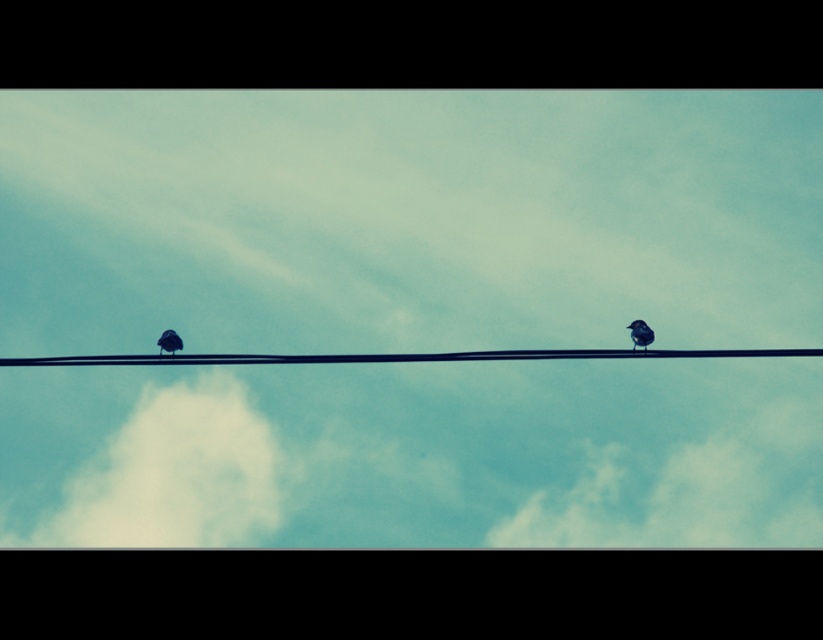
Is point (814, 516) closer to camera compared to point (180, 344)?

No, it is not.

Is point (751, 486) positioned behind point (171, 344)?

Yes, point (751, 486) is behind point (171, 344).

Image resolution: width=823 pixels, height=640 pixels. Describe the element at coordinates (689, 492) in the screenshot. I see `white fluffy cloud at upper center` at that location.

Find the location of a particular element. This screenshot has width=823, height=640. white fluffy cloud at upper center is located at coordinates (689, 492).

Between point (803, 435) and point (115, 355), which one is positioned behind?

The point (803, 435) is behind.

Identify the location of white fluffy cloud at upper center. (689, 492).

I want to click on white fluffy cloud at upper center, so click(689, 492).

Who is more distant from viewer, (133,528) or (171,340)?

The point (133,528) is more distant.

Does white fluffy cloud at lower left appear under silvery metallic bird at left?

Indeed, white fluffy cloud at lower left is positioned under silvery metallic bird at left.

Between point (72, 536) and point (163, 348), which one is positioned in front?

Positioned in front is point (163, 348).

At what (x,y) coordinates should I click in order to perform the action: click on white fluffy cloud at lower left. Please return your answer as a coordinate pair (x, y). Looking at the image, I should click on (175, 474).